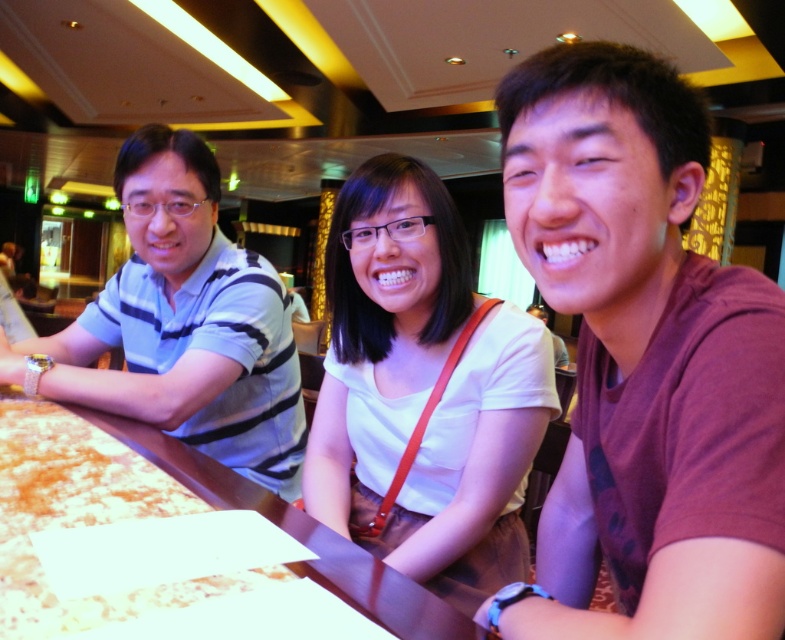
You are a photographer setting up a shoot in this restaurant scene. You need to ensure that the striped cotton shirt at left is visible in the frame without being blocked by the brown wooden table at center. Based on their positions, is this possible?

The striped cotton shirt at left is positioned over the brown wooden table at center, meaning it is placed above the table. Since it is above, it won not be blocked by the table, so it should be visible in the frame.

You are sitting at the brown wooden table at center in the restaurant. You want to hand a napkin to the person wearing the white matte shirt at center. In which direction should you move your hand to reach them?

The white matte shirt at center is to the right of the brown wooden table at center, so you should move your hand to the right to reach them.

You are a photographer standing in front of the striped cotton shirt at left and the brown wooden table at center. Which object is closer to you?

The striped cotton shirt at left is closer to you because it is further to the viewer than the brown wooden table at center.